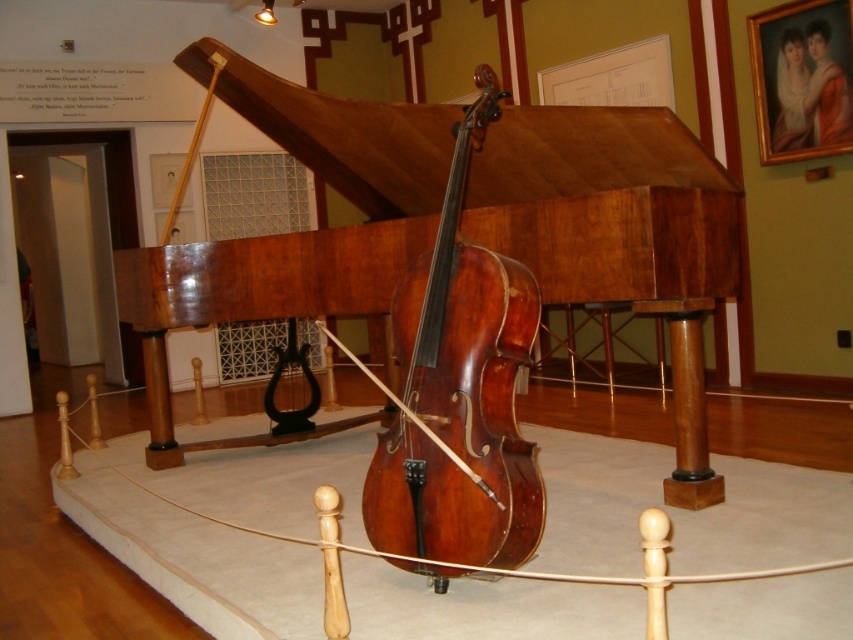
In the scene shown: How distant is shiny brown wood cello at center from matte oil painting at upper right?

3.60 meters

Is shiny brown wood cello at center smaller than matte oil painting at upper right?

Incorrect, shiny brown wood cello at center is not smaller in size than matte oil painting at upper right.

Is point (483, 509) positioned before point (788, 49)?

Yes, point (483, 509) is closer to viewer.

Where is `shiny brown wood cello at center`? Image resolution: width=853 pixels, height=640 pixels. shiny brown wood cello at center is located at coordinates (459, 394).

Is shiny polished wood piano at center closer to the viewer compared to shiny brown wood cello at center?

No, shiny polished wood piano at center is behind shiny brown wood cello at center.

Which is more to the left, shiny polished wood piano at center or shiny brown wood cello at center?

shiny polished wood piano at center is more to the left.

You are a GUI agent. You are given a task and a screenshot of the screen. Output one action in this format:
    pyautogui.click(x=<x>, y=<y>)
    Task: Click on the shiny polished wood piano at center
    This screenshot has height=640, width=853.
    Given the screenshot: What is the action you would take?
    pyautogui.click(x=616, y=234)

Find the location of a particular element. The image size is (853, 640). shiny polished wood piano at center is located at coordinates (616, 234).

Does point (718, 497) lie behind point (805, 58)?

No, it is in front of (805, 58).

From the picture: How distant is shiny polished wood piano at center from matte oil painting at upper right?

shiny polished wood piano at center is 2.92 meters from matte oil painting at upper right.

Is point (648, 282) more distant than point (813, 99)?

That is False.

You are a GUI agent. You are given a task and a screenshot of the screen. Output one action in this format:
    pyautogui.click(x=<x>, y=<y>)
    Task: Click on the shiny polished wood piano at center
    This screenshot has width=853, height=640.
    Given the screenshot: What is the action you would take?
    pyautogui.click(x=616, y=234)